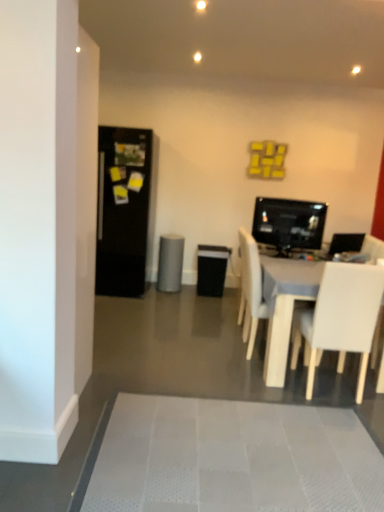
Locate an element on the screen. This screenshot has height=512, width=384. blank area to the left of white matte chair at lower right, marked as the first chair in a front-to-back arrangement is located at coordinates (276, 386).